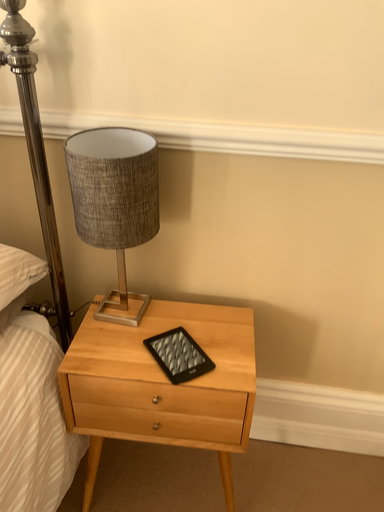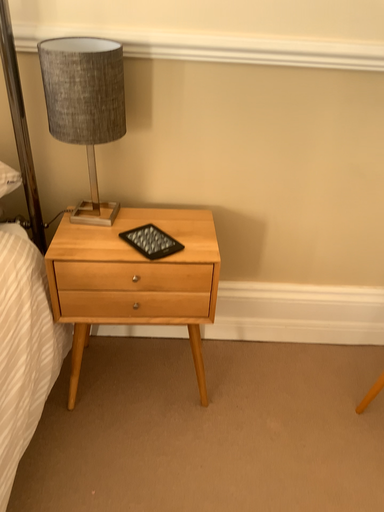
Question: How did the camera likely rotate when shooting the video?

Choices:
 (A) rotated right
 (B) rotated left

Answer: (A)